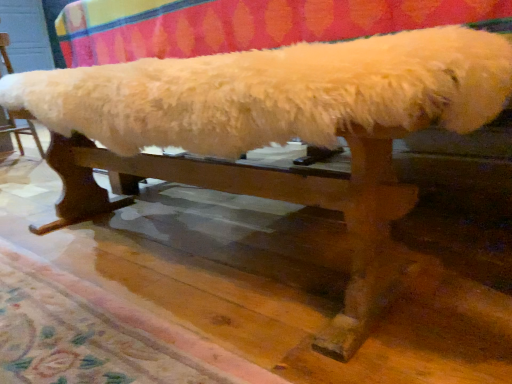
Question: Choose the correct answer: Is white fluffy bench at upper center inside carpeted floor at lower center or outside it?

Choices:
 (A) outside
 (B) inside

Answer: (A)

Question: Is white fluffy bench at upper center taller or shorter than carpeted floor at lower center?

Choices:
 (A) short
 (B) tall

Answer: (B)

Question: Based on their positions, is white fluffy bench at upper center located to the left or right of carpeted floor at lower center?

Choices:
 (A) right
 (B) left

Answer: (B)

Question: In terms of size, does carpeted floor at lower center appear bigger or smaller than white fluffy bench at upper center?

Choices:
 (A) small
 (B) big

Answer: (A)

Question: Is carpeted floor at lower center situated inside white fluffy bench at upper center or outside?

Choices:
 (A) inside
 (B) outside

Answer: (B)

Question: From a real-world perspective, is carpeted floor at lower center physically located above or below white fluffy bench at upper center?

Choices:
 (A) above
 (B) below

Answer: (B)

Question: Is point (2, 249) closer or farther from the camera than point (6, 49)?

Choices:
 (A) closer
 (B) farther

Answer: (A)